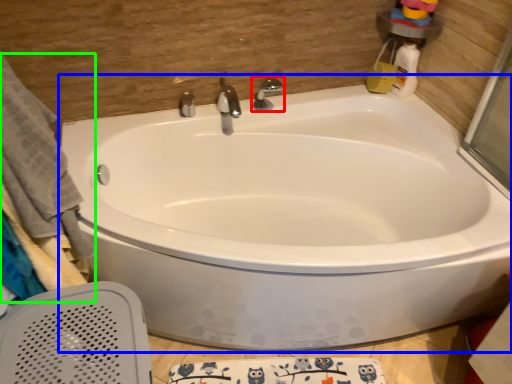
Question: Considering the real-world distances, which object is closest to tap (highlighted by a red box)? bathtub (highlighted by a blue box) or bath towel (highlighted by a green box).

Choices:
 (A) bathtub
 (B) bath towel

Answer: (A)